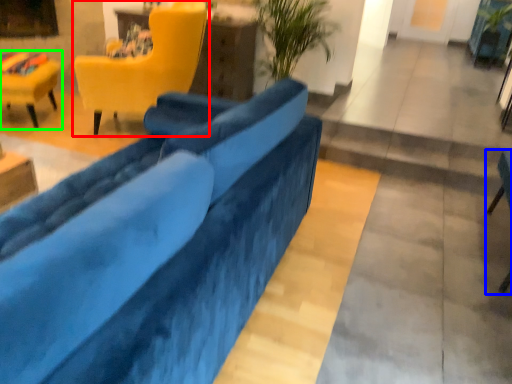
Question: Based on their relative distances, which object is nearer to chair (highlighted by a red box)? Choose from chair (highlighted by a blue box) and chair (highlighted by a green box).

Choices:
 (A) chair
 (B) chair

Answer: (B)